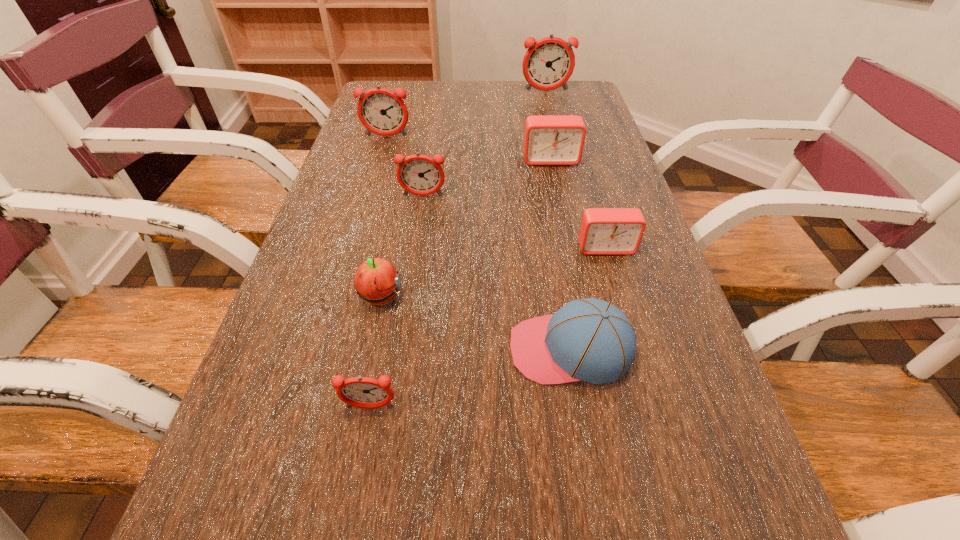
At what (x,y) coordinates should I click in order to perform the action: click on the tallest object. Please return your answer as a coordinate pair (x, y). Looking at the image, I should click on (548, 64).

Where is `the tallest alarm clock`? the tallest alarm clock is located at coordinates (548, 64).

The height and width of the screenshot is (540, 960). What are the coordinates of `the second tallest object` in the screenshot? It's located at (383, 112).

Identify the location of the second tallest alarm clock. (383, 112).

The width and height of the screenshot is (960, 540). In order to click on the third biggest reddish-pink alarm clock in this screenshot , I will do `click(421, 175)`.

The image size is (960, 540). Find the location of `the fourth farthest object`. the fourth farthest object is located at coordinates (421, 175).

You are a GUI agent. You are given a task and a screenshot of the screen. Output one action in this format:
    pyautogui.click(x=<x>, y=<y>)
    Task: Click on the third farthest object
    The width and height of the screenshot is (960, 540).
    Given the screenshot: What is the action you would take?
    pyautogui.click(x=548, y=139)

You are a GUI agent. You are given a task and a screenshot of the screen. Output one action in this format:
    pyautogui.click(x=<x>, y=<y>)
    Task: Click on the farther red alarm clock
    This screenshot has width=960, height=540.
    Given the screenshot: What is the action you would take?
    pyautogui.click(x=548, y=139)

The height and width of the screenshot is (540, 960). Identify the location of blue baseball cap. (588, 339).

Find the location of a particular element. apple is located at coordinates (376, 281).